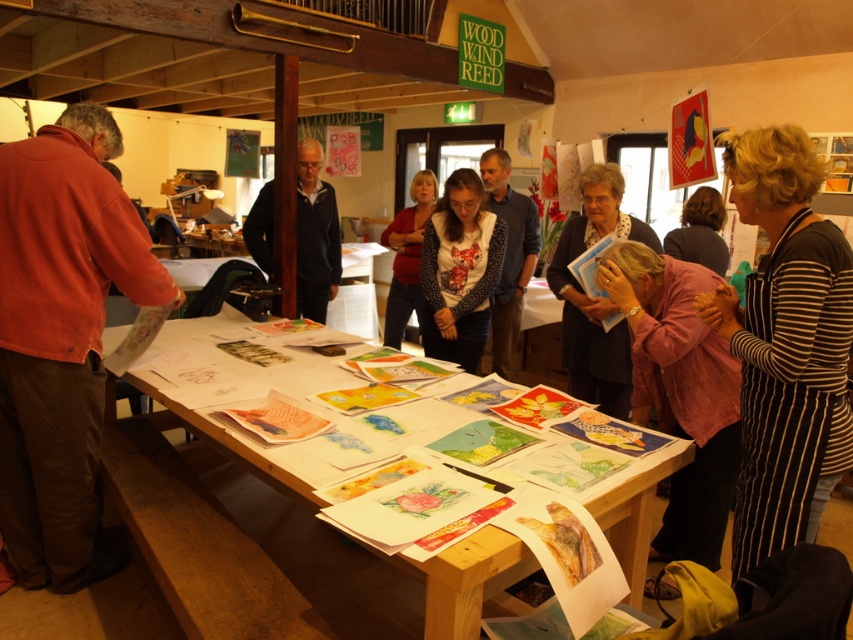
You are an art instructor standing at the front of the room. You need to hand out a new set of colored pencils to both the person wearing the matte red shirt at left and the person with dark brown hair at center. Based on their positions, which person should you approach first to ensure you can reach them without walking past the other?

You should approach the matte red shirt at left first because they are in front of the dark brown hair at center, so you can reach them without needing to walk past the other person.

You are an interior designer assessing the space for a new piece of furniture. You notice the matte red shirt at left and the pink fabric at center. Which object has a greater width that might require more space in the room?

The matte red shirt at left has a larger width than the pink fabric at center, so it requires more space in the room.